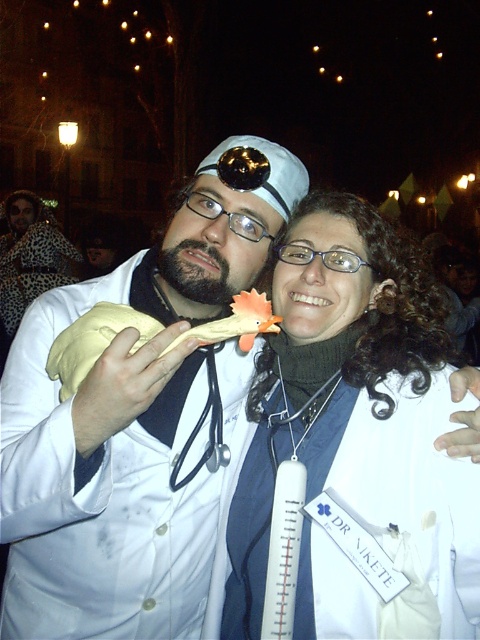
Question: Which object appears closest to the camera in this image?

Choices:
 (A) white fabric thermometer at center
 (B) yellow fabric toy at center

Answer: (B)

Question: Which object is positioned farthest from the black rubber stethoscope at center?

Choices:
 (A) white fabric thermometer at center
 (B) yellow fabric toy at center

Answer: (B)

Question: Does white fabric thermometer at center appear over black rubber stethoscope at center?

Choices:
 (A) yes
 (B) no

Answer: (A)

Question: Can you confirm if white fabric thermometer at center is smaller than yellow fabric toy at center?

Choices:
 (A) no
 (B) yes

Answer: (A)

Question: Which point is closer to the camera?

Choices:
 (A) white fabric thermometer at center
 (B) yellow fabric toy at center

Answer: (B)

Question: Is yellow fabric toy at center wider than black rubber stethoscope at center?

Choices:
 (A) yes
 (B) no

Answer: (A)